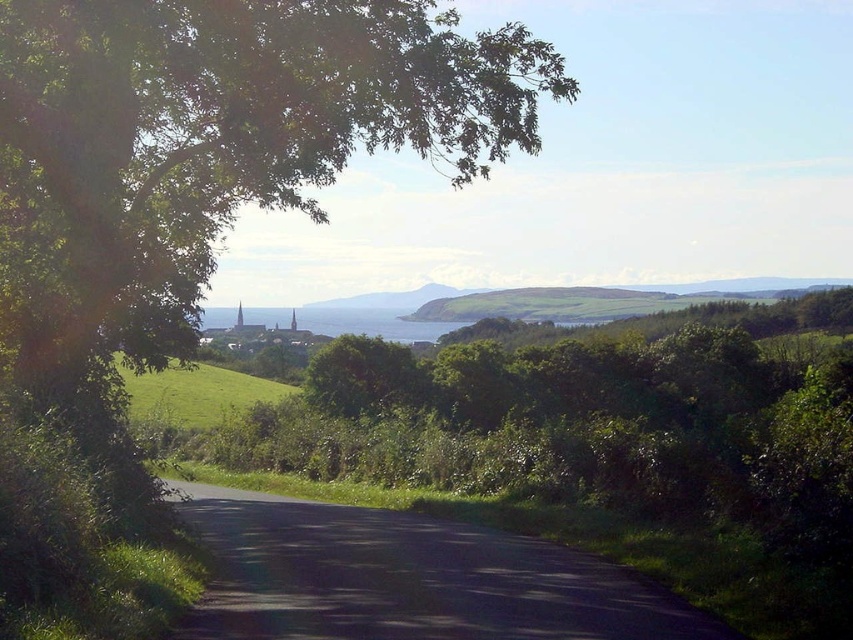
You are planning to drive a truck that is 2 meters wide along the black asphalt road at center. Considering the blue water at center is wider than the road, will the road be wide enough for your truck?

The black asphalt road at center has a lesser width compared to blue water at center. Since the road is narrower than the water, and the truck is 2 meters wide, the road may not be wide enough. Check the road width before proceeding.

In the scene shown: You are standing at the point with coordinates (408, 579) in the image. What object are you standing on?

The point at coordinates (408, 579) is on the black asphalt road at center.